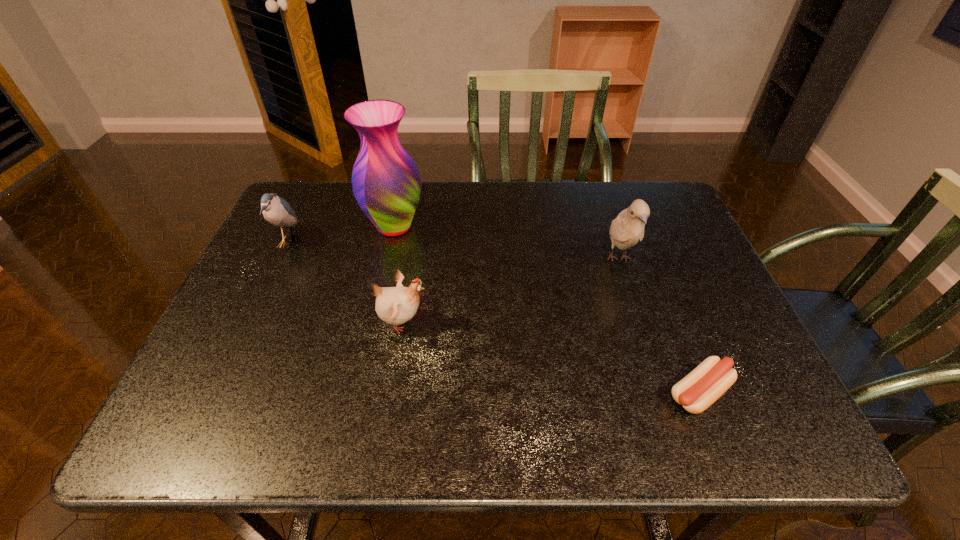
Identify the location of object located at the near right corner. (698, 390).

This screenshot has height=540, width=960. Find the location of `vacant space at the far edge of the desktop`. vacant space at the far edge of the desktop is located at coordinates pos(497,193).

This screenshot has width=960, height=540. In the image, there is a desktop. In order to click on vacant space at the near edge in this screenshot , I will do `click(438, 403)`.

What are the coordinates of `free spot at the left edge of the desktop` in the screenshot? It's located at (279, 241).

This screenshot has width=960, height=540. In the image, there is a desktop. In order to click on vacant space at the right edge in this screenshot , I will do `click(658, 297)`.

At what (x,y) coordinates should I click in order to perform the action: click on vacant space at the far left corner. Please return your answer as a coordinate pair (x, y). The height and width of the screenshot is (540, 960). Looking at the image, I should click on (320, 219).

Where is `vacant space at the near left corner of the desktop`? This screenshot has width=960, height=540. vacant space at the near left corner of the desktop is located at coordinates pyautogui.click(x=217, y=428).

You are a GUI agent. You are given a task and a screenshot of the screen. Output one action in this format:
    pyautogui.click(x=<x>, y=<y>)
    Task: Click on the unoccupied area between the shortest object and the rightmost bird
    The height and width of the screenshot is (540, 960).
    Given the screenshot: What is the action you would take?
    pyautogui.click(x=659, y=326)

The image size is (960, 540). In order to click on vacant point located between the tallest object and the fourth shortest object in this screenshot , I will do pyautogui.click(x=506, y=242).

The height and width of the screenshot is (540, 960). What are the coordinates of `vacant region between the second bird from left to right and the second shortest bird` in the screenshot? It's located at click(345, 282).